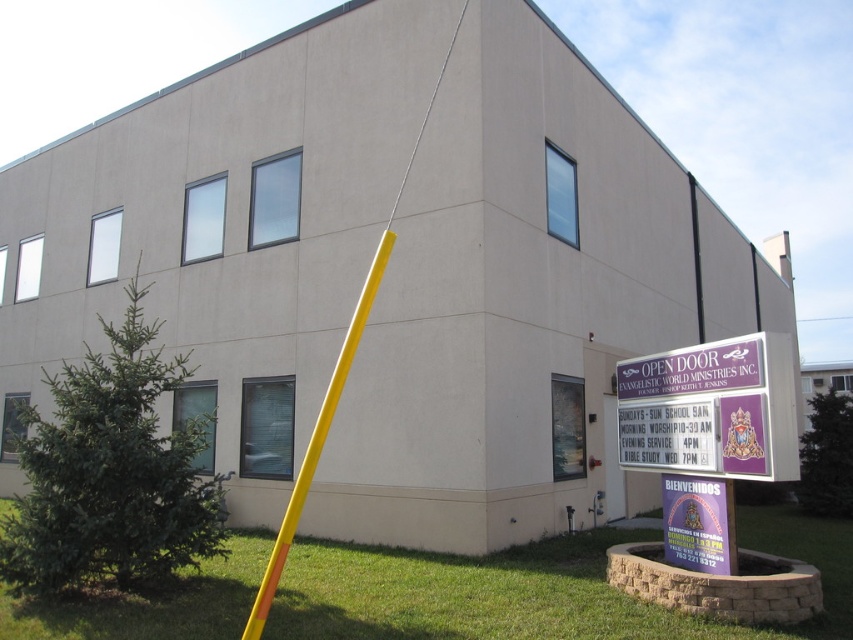
Question: Is purple matte sign at lower right to the right of purple paper sign at lower right from the viewer's perspective?

Choices:
 (A) yes
 (B) no

Answer: (B)

Question: From the image, what is the correct spatial relationship of purple matte sign at lower right in relation to yellow plastic pole at center?

Choices:
 (A) below
 (B) above

Answer: (B)

Question: Which object is positioned farthest from the yellow plastic pole at center?

Choices:
 (A) purple paper sign at lower right
 (B) purple matte sign at lower right

Answer: (A)

Question: Which of the following is the closest to the observer?

Choices:
 (A) (757, 368)
 (B) (717, 512)

Answer: (A)

Question: Which point is farther to the camera?

Choices:
 (A) purple matte sign at lower right
 (B) yellow plastic pole at center

Answer: (B)

Question: Is purple matte sign at lower right positioned in front of purple paper sign at lower right?

Choices:
 (A) no
 (B) yes

Answer: (B)